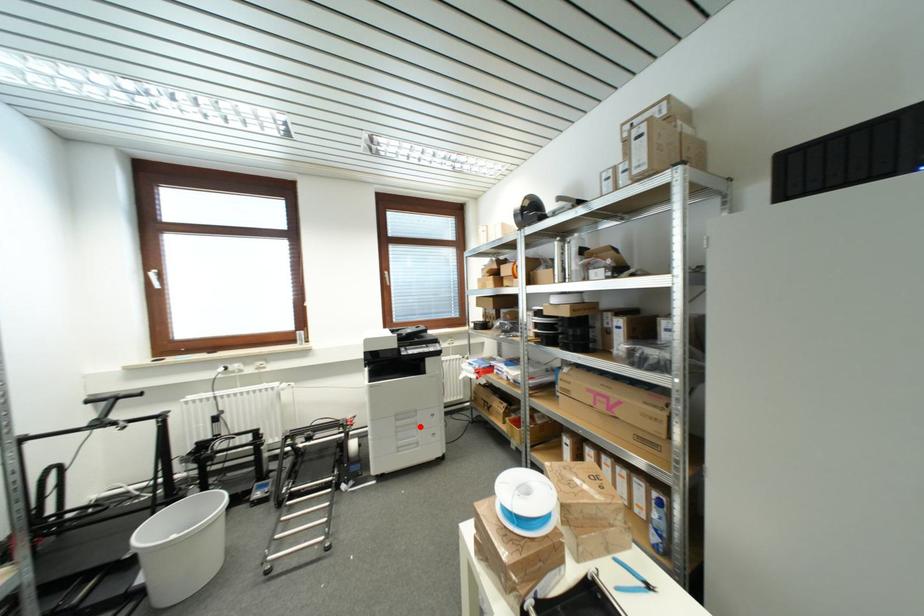
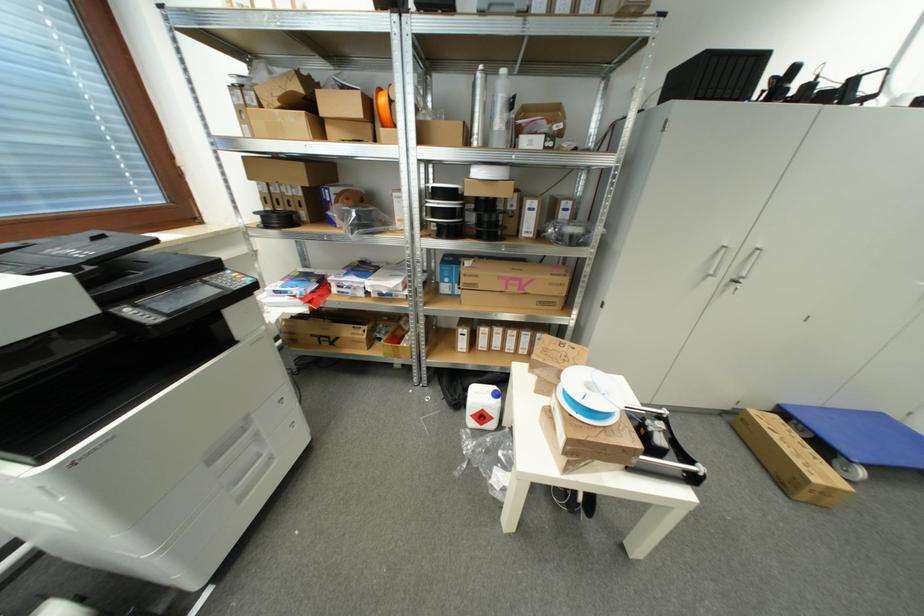
Question: I am providing you with two images of the same scene from different viewpoints. Given a red point in image1, look at the same physical point in image2. Is it:

Choices:
 (A) Closer to the viewpoint
 (B) Farther from the viewpoint

Answer: (A)